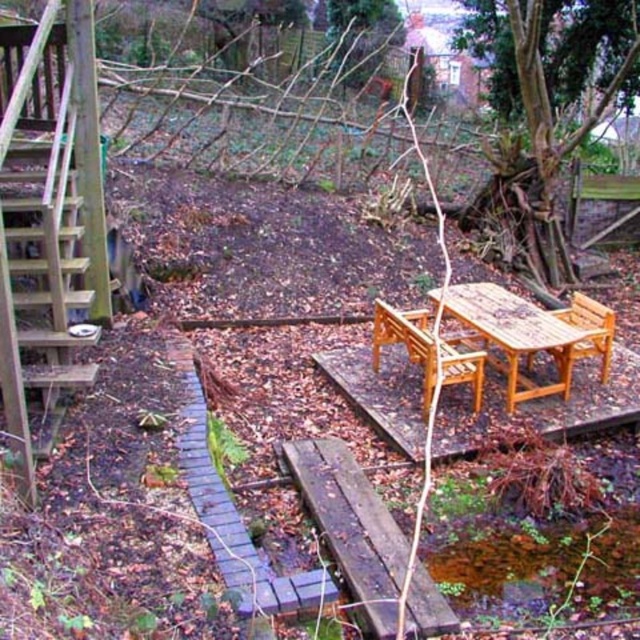
Question: Which object is the farthest from the wooden chair at center?

Choices:
 (A) light brown wooden table at center
 (B) light brown wooden chair at center
 (C) rusty wooden bench at center

Answer: (C)

Question: Can you confirm if light brown wooden table at center is bigger than light brown wooden chair at center?

Choices:
 (A) no
 (B) yes

Answer: (B)

Question: Among these objects, which one is farthest from the camera?

Choices:
 (A) rusty wooden bench at center
 (B) brown rough tree at upper right

Answer: (B)

Question: Which point is farther to the camera?

Choices:
 (A) (563, 324)
 (B) (380, 337)
 (C) (531, 129)
 (D) (440, 598)

Answer: (C)

Question: Can you confirm if brown rough tree at upper right is positioned above light brown wooden table at center?

Choices:
 (A) no
 (B) yes

Answer: (B)

Question: Is light brown wooden table at center above light brown wooden chair at center?

Choices:
 (A) yes
 (B) no

Answer: (A)